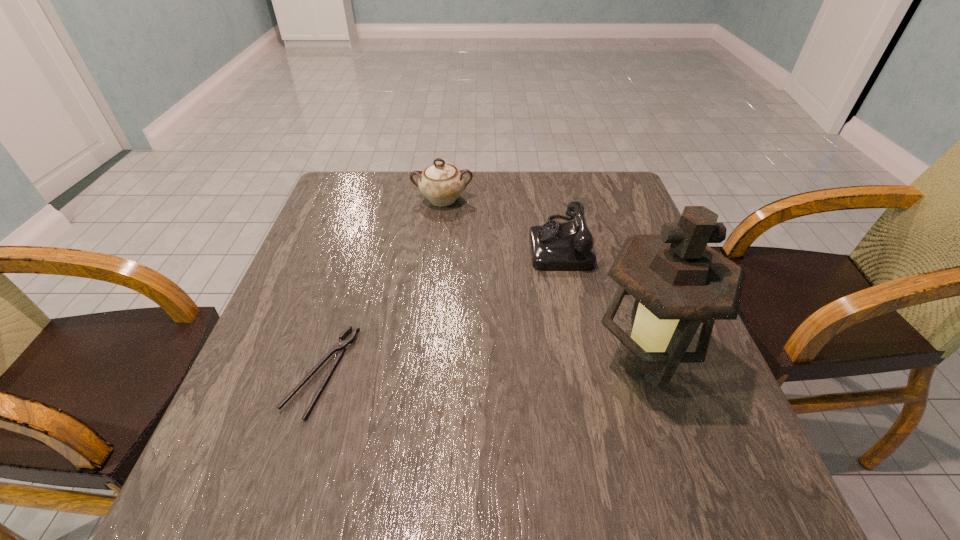
At what (x,y) coordinates should I click in order to perform the action: click on vacant area at the far right corner. Please return your answer as a coordinate pair (x, y). The image size is (960, 540). Looking at the image, I should click on (605, 187).

At what (x,y) coordinates should I click in order to perform the action: click on free space between the tongs and the tallest object. Please return your answer as a coordinate pair (x, y). This screenshot has width=960, height=540. Looking at the image, I should click on (482, 367).

This screenshot has width=960, height=540. Identify the location of vacant space in between the tallest object and the third tallest object. (x=600, y=303).

I want to click on unoccupied position between the leftmost object and the tallest object, so click(x=482, y=367).

Locate an element on the screen. free space between the telephone and the second object from left to right is located at coordinates (501, 221).

Image resolution: width=960 pixels, height=540 pixels. I want to click on free spot between the oil lamp and the third object from right to left, so click(x=542, y=281).

Where is `free space between the chinaware and the third nearest object`? Image resolution: width=960 pixels, height=540 pixels. free space between the chinaware and the third nearest object is located at coordinates (501, 221).

What are the coordinates of `vacant area that lies between the oil lamp and the third nearest object` in the screenshot? It's located at (600, 303).

Find the location of a particular element. free spot between the chinaware and the telephone is located at coordinates (501, 221).

At what (x,y) coordinates should I click in order to perform the action: click on free space between the tongs and the telephone. Please return your answer as a coordinate pair (x, y). The image size is (960, 540). Looking at the image, I should click on (441, 307).